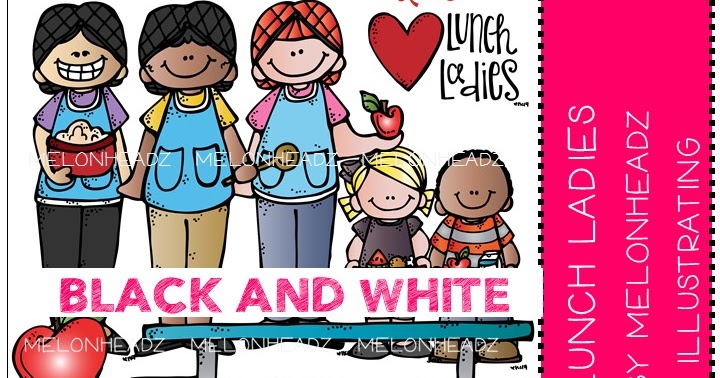
Where is `spoon`? Image resolution: width=720 pixels, height=378 pixels. spoon is located at coordinates (281, 156).